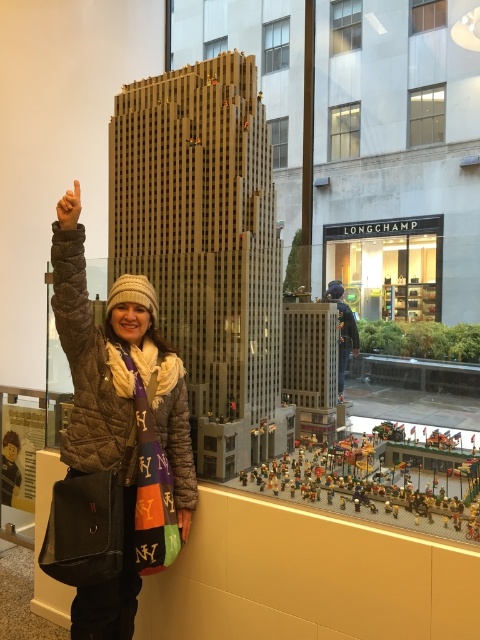
Is brown fuzzy jacket at upper left smaller than matte black hand at upper left?

No, brown fuzzy jacket at upper left is not smaller than matte black hand at upper left.

Does point (184, 419) lie behind point (180, 509)?

Yes.

Which is behind, point (179, 486) or point (184, 536)?

The point (179, 486) is more distant.

Locate an element on the screen. brown fuzzy jacket at upper left is located at coordinates (181, 458).

Does brown quilted jacket at left have a greater height compared to brown fuzzy coat at upper left?

Yes.

Is point (117, 486) farther from viewer compared to point (78, 346)?

No, it is in front of (78, 346).

Describe the element at coordinates (115, 448) in the screenshot. The height and width of the screenshot is (640, 480). I see `brown quilted jacket at left` at that location.

Find the location of a particular element. Image resolution: width=480 pixels, height=640 pixels. brown quilted jacket at left is located at coordinates (115, 448).

Does brown fuzzy coat at upper left have a smaller size compared to brown matte hand at upper left?

Actually, brown fuzzy coat at upper left might be larger than brown matte hand at upper left.

In the scene shown: Which is more to the left, brown fuzzy coat at upper left or brown matte hand at upper left?

brown fuzzy coat at upper left is more to the left.

What do you see at coordinates (70, 276) in the screenshot?
I see `brown fuzzy coat at upper left` at bounding box center [70, 276].

Locate an element on the screen. The height and width of the screenshot is (640, 480). brown fuzzy coat at upper left is located at coordinates (70, 276).